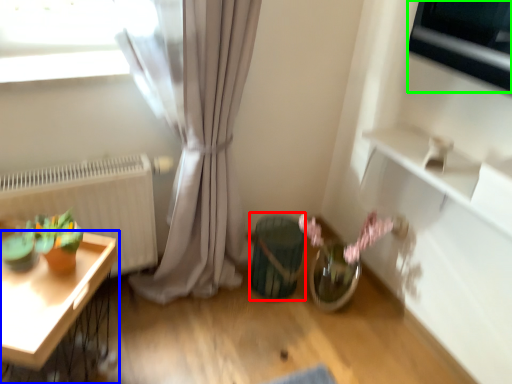
Question: Which object is the farthest from vase (highlighted by a red box)? Choose among these: table (highlighted by a blue box) or appliance (highlighted by a green box).

Choices:
 (A) table
 (B) appliance

Answer: (B)